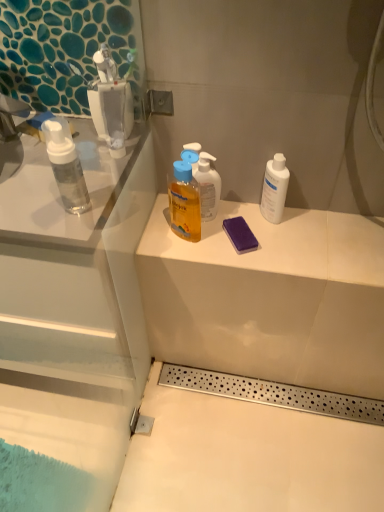
Question: Are translucent yellow liquid at upper center and white matte bottle at right beside each other?

Choices:
 (A) yes
 (B) no

Answer: (B)

Question: Can you confirm if translucent yellow liquid at upper center is positioned to the right of white matte bottle at right?

Choices:
 (A) yes
 (B) no

Answer: (B)

Question: From a real-world perspective, is translucent yellow liquid at upper center positioned under white matte bottle at right based on gravity?

Choices:
 (A) no
 (B) yes

Answer: (A)

Question: From a real-world perspective, is translucent yellow liquid at upper center on top of white matte bottle at right?

Choices:
 (A) yes
 (B) no

Answer: (A)

Question: Is translucent yellow liquid at upper center further to camera compared to white matte bottle at right?

Choices:
 (A) yes
 (B) no

Answer: (B)

Question: Is translucent yellow liquid at upper center positioned with its back to white matte bottle at right?

Choices:
 (A) no
 (B) yes

Answer: (A)

Question: From the image's perspective, is white matte bottle at right over translucent yellow liquid at upper center?

Choices:
 (A) yes
 (B) no

Answer: (A)

Question: From the image's perspective, would you say white matte bottle at right is shown under translucent yellow liquid at upper center?

Choices:
 (A) yes
 (B) no

Answer: (B)

Question: Does white matte bottle at right have a lesser width compared to translucent yellow liquid at upper center?

Choices:
 (A) yes
 (B) no

Answer: (A)

Question: Is white matte bottle at right facing towards translucent yellow liquid at upper center?

Choices:
 (A) yes
 (B) no

Answer: (B)

Question: From a real-world perspective, is white matte bottle at right positioned under translucent yellow liquid at upper center based on gravity?

Choices:
 (A) no
 (B) yes

Answer: (B)

Question: Is white matte bottle at right closer to the viewer compared to translucent yellow liquid at upper center?

Choices:
 (A) no
 (B) yes

Answer: (A)

Question: Can you confirm if purple sponge at center is thinner than matte white counter at center?

Choices:
 (A) yes
 (B) no

Answer: (A)